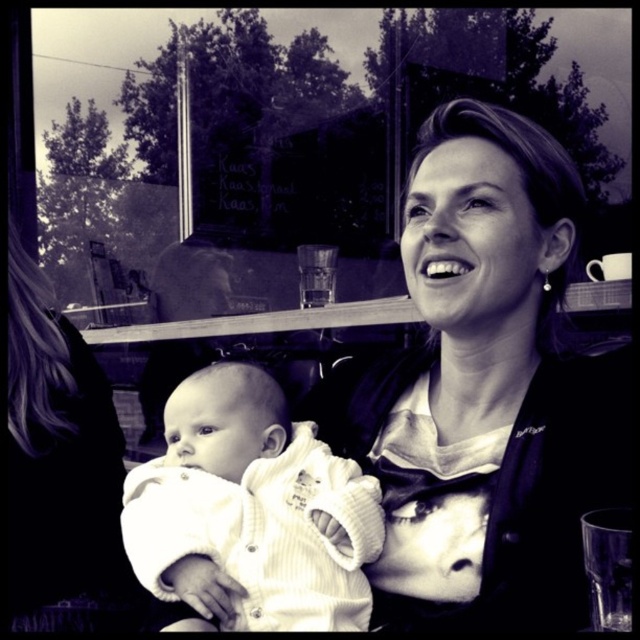
You are a photographer trying to capture a closeup of the baby in the center. You notice there are two babies labeled as white corduroy baby at center and white soft baby at center. Which baby should you focus on if you want to photograph the one that is lower in the image?

The white corduroy baby at center is located below the white soft baby at center, so you should focus on the white corduroy baby at center to photograph the lower one.